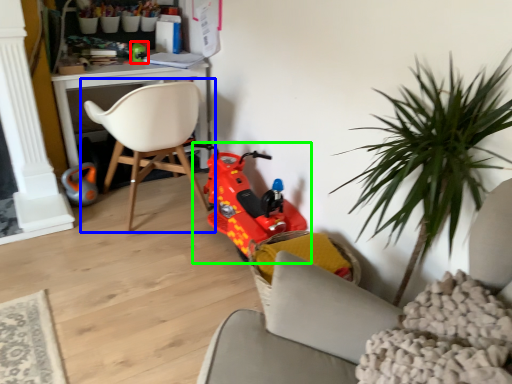
Question: Based on their relative distances, which object is nearer to toy (highlighted by a red box)? Choose from chair (highlighted by a blue box) and toy (highlighted by a green box).

Choices:
 (A) chair
 (B) toy

Answer: (A)